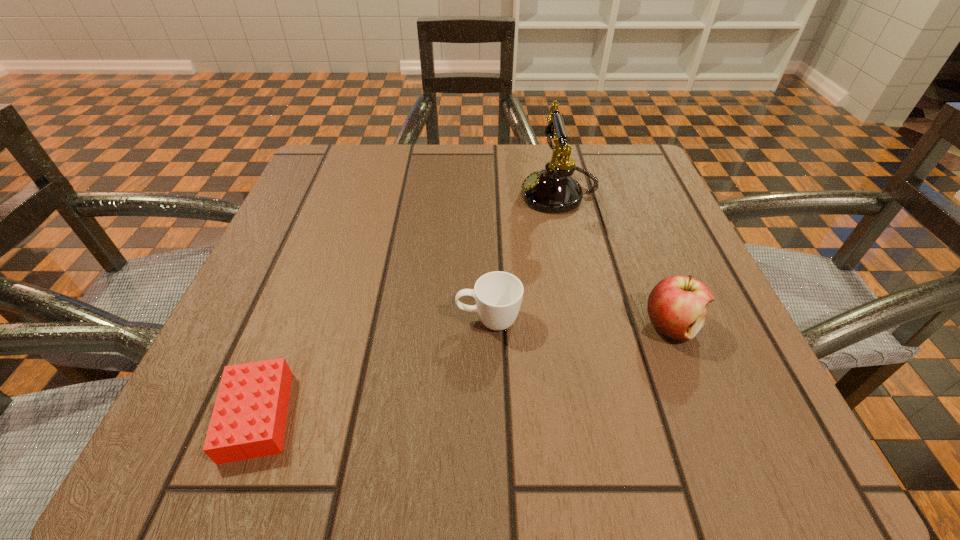
Where is `empty location between the tallest object and the rightmost object`? empty location between the tallest object and the rightmost object is located at coordinates (615, 260).

At what (x,y) coordinates should I click in order to perform the action: click on free area in between the apple and the third object from right to left. Please return your answer as a coordinate pair (x, y). Looking at the image, I should click on (580, 323).

This screenshot has height=540, width=960. I want to click on empty space between the second object from left to right and the Lego, so click(x=372, y=368).

This screenshot has height=540, width=960. Find the location of `empty space that is in between the apple and the Lego`. empty space that is in between the apple and the Lego is located at coordinates (465, 371).

I want to click on vacant area that lies between the tallest object and the apple, so click(x=615, y=260).

This screenshot has width=960, height=540. Find the location of `unoccupied position between the shortest object and the tallest object`. unoccupied position between the shortest object and the tallest object is located at coordinates (408, 305).

Image resolution: width=960 pixels, height=540 pixels. In order to click on vacant region between the leftmost object and the cup in this screenshot , I will do `click(372, 368)`.

This screenshot has width=960, height=540. What are the coordinates of `free space between the second tallest object and the Lego` in the screenshot? It's located at click(465, 371).

I want to click on free space that is in between the third tallest object and the rightmost object, so click(580, 323).

This screenshot has height=540, width=960. In order to click on object that can be found as the third closest to the rightmost object in this screenshot , I will do `click(248, 421)`.